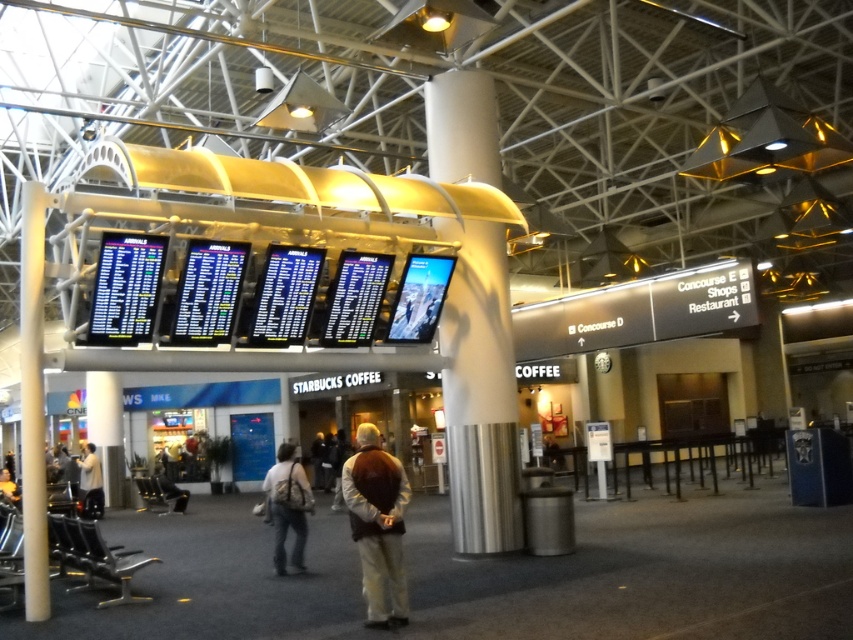
Question: Can you confirm if denim jacket at center is thinner than light beige shirt at lower left?

Choices:
 (A) no
 (B) yes

Answer: (A)

Question: Is brown suede jacket at center positioned at the back of light beige shirt at lower left?

Choices:
 (A) no
 (B) yes

Answer: (A)

Question: Is white glossy pillar at center wider than denim jacket at center?

Choices:
 (A) yes
 (B) no

Answer: (B)

Question: Which point is farther to the camera?

Choices:
 (A) (90, 499)
 (B) (283, 554)
 (C) (357, 440)

Answer: (A)

Question: Based on their relative distances, which object is nearer to the denim jacket at center?

Choices:
 (A) white glossy pillar at center
 (B) brown suede jacket at center

Answer: (A)

Question: Based on their relative distances, which object is farther from the white glossy pillar at center?

Choices:
 (A) brown suede jacket at center
 (B) light beige shirt at lower left

Answer: (B)